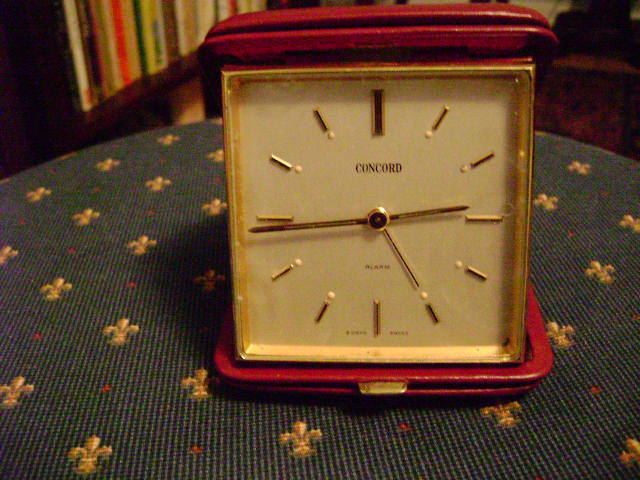
Locate an element on the screen. book shelf in the background is located at coordinates tap(124, 50).